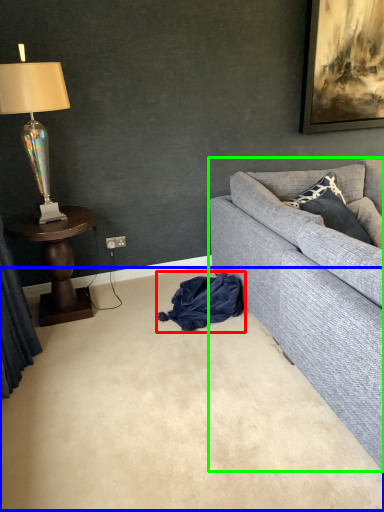
Question: Considering the real-world distances, which object is farthest from material (highlighted by a red box)? plain (highlighted by a blue box) or studio couch (highlighted by a green box)?

Choices:
 (A) plain
 (B) studio couch

Answer: (A)